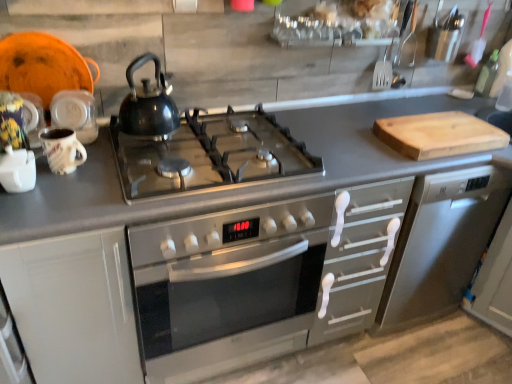
You are a GUI agent. You are given a task and a screenshot of the screen. Output one action in this format:
    pyautogui.click(x=<x>, y=<y>)
    Task: Click on the vacant area that is situated to the right of white matte coffee cup at left, which is the 2th appliance from top to bottom
    
    Given the screenshot: What is the action you would take?
    pyautogui.click(x=75, y=198)